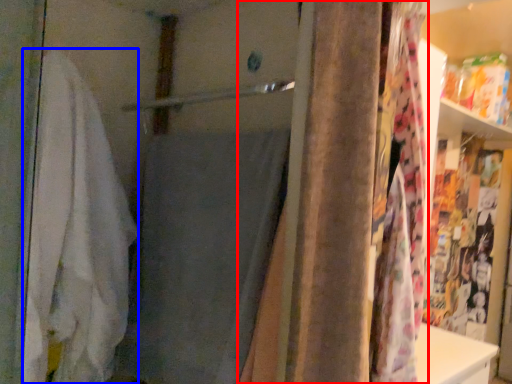
Question: Which point is further to the camera, curtain (highlighted by a red box) or bath towel (highlighted by a blue box)?

Choices:
 (A) curtain
 (B) bath towel

Answer: (B)